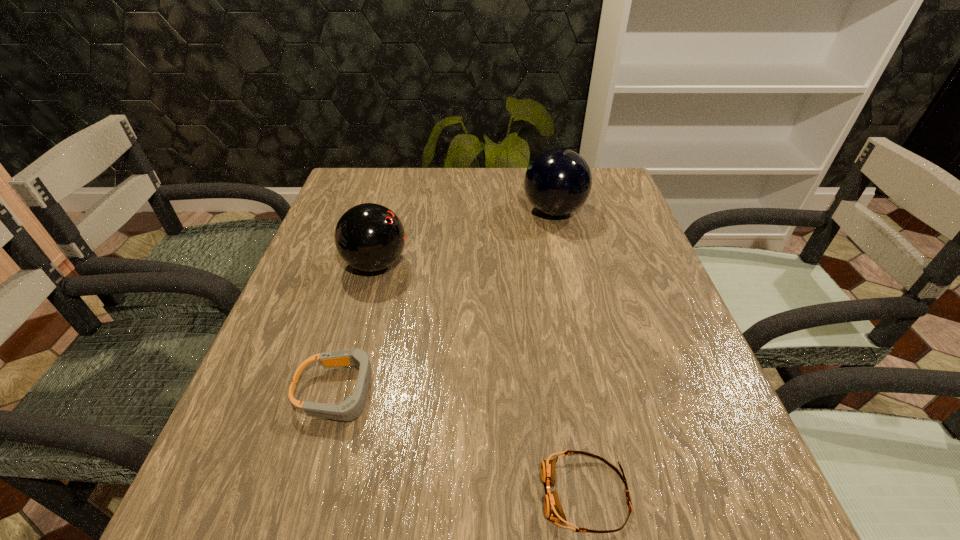
The width and height of the screenshot is (960, 540). In order to click on object that is at the right edge in this screenshot , I will do `click(558, 181)`.

You are a GUI agent. You are given a task and a screenshot of the screen. Output one action in this format:
    pyautogui.click(x=<x>, y=<y>)
    Task: Click on the object positioned at the far right corner
    This screenshot has height=540, width=960.
    Given the screenshot: What is the action you would take?
    click(x=558, y=181)

Image resolution: width=960 pixels, height=540 pixels. In the image, there is a desktop. Find the location of `free region at the far edge`. free region at the far edge is located at coordinates (471, 180).

Locate an element on the screen. vacant space at the near edge of the desktop is located at coordinates (583, 504).

Identify the location of free location at the left edge of the desktop. This screenshot has height=540, width=960. (338, 278).

You are a GUI agent. You are given a task and a screenshot of the screen. Output one action in this format:
    pyautogui.click(x=<x>, y=<y>)
    Task: Click on the vacant space at the right edge of the desktop
    The height and width of the screenshot is (540, 960).
    Given the screenshot: What is the action you would take?
    pyautogui.click(x=703, y=396)

Locate an element on the screen. free spot at the far left corner of the desktop is located at coordinates (348, 184).

Identify the location of blank area at the near left corner. This screenshot has height=540, width=960. (252, 483).

This screenshot has width=960, height=540. Find the location of `free space at the far right corner of the desktop`. free space at the far right corner of the desktop is located at coordinates (598, 192).

Find the location of a particular element. The image size is (960, 540). free space at the near right corner of the desktop is located at coordinates (742, 497).